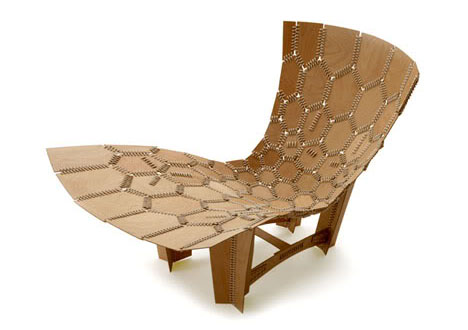
Identify the location of brown chair color. (268, 188).